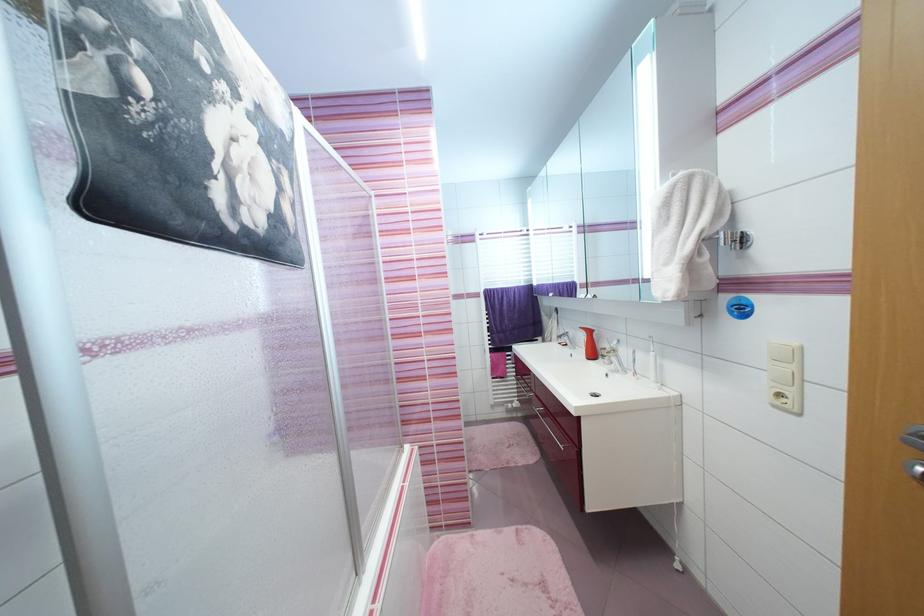
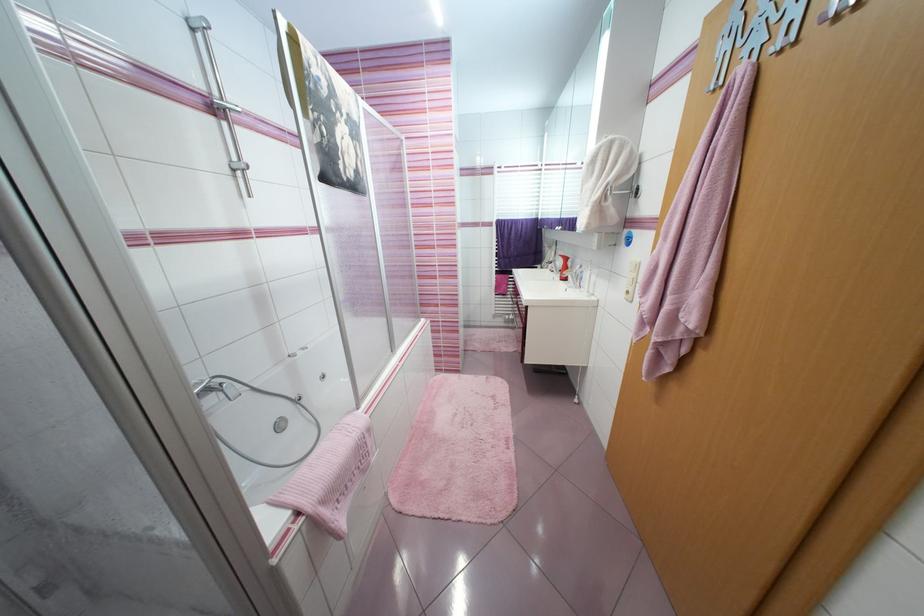
Locate, in the second image, the point that corresponds to point 576,336 in the first image.

(563, 264)